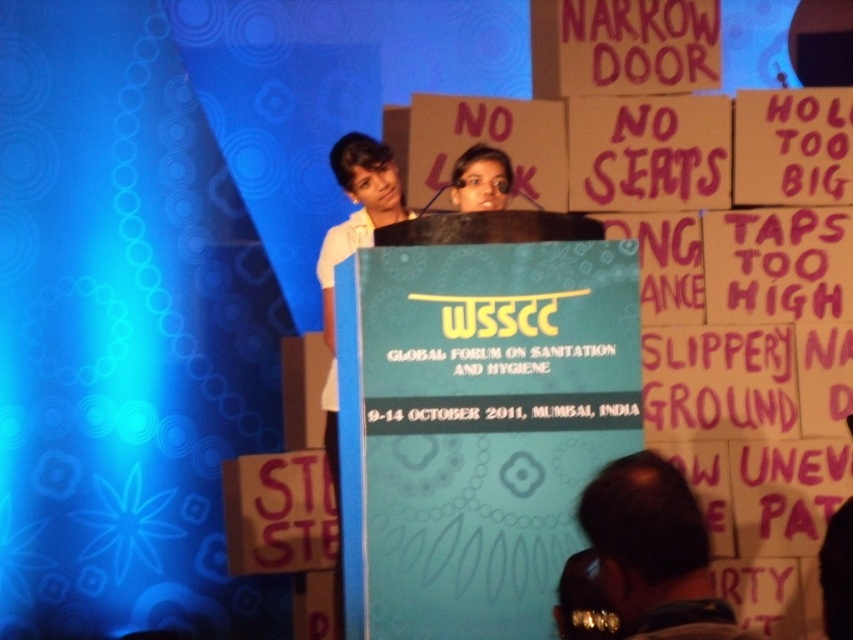
The height and width of the screenshot is (640, 853). Describe the element at coordinates (654, 552) in the screenshot. I see `dark brown leather jacket at lower right` at that location.

You are a GUI agent. You are given a task and a screenshot of the screen. Output one action in this format:
    pyautogui.click(x=<x>, y=<y>)
    Task: Click on the dark brown leather jacket at lower right
    The image size is (853, 640).
    Given the screenshot: What is the action you would take?
    pos(654,552)

Locate an element on the screen. This screenshot has width=853, height=640. dark brown leather jacket at lower right is located at coordinates (654, 552).